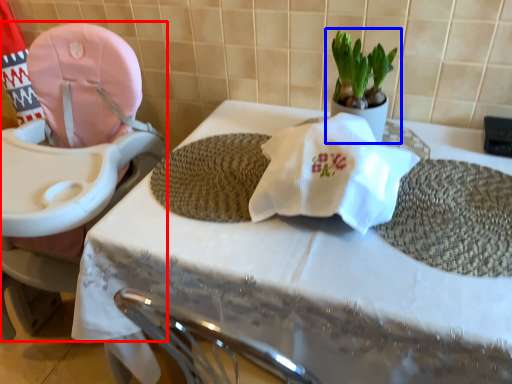
Question: Which object is closer to the camera taking this photo, baby carriage (highlighted by a red box) or houseplant (highlighted by a blue box)?

Choices:
 (A) baby carriage
 (B) houseplant

Answer: (A)